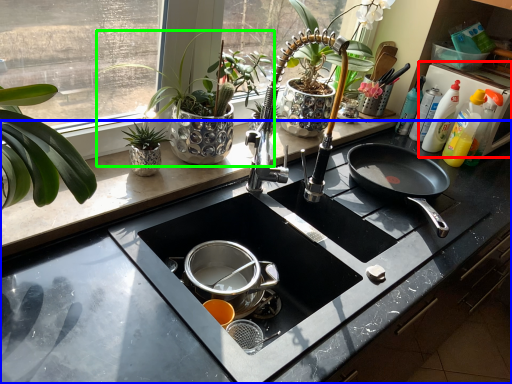
Question: Which object is the closest to the appliance (highlighted by a red box)? Choose among these: countertop (highlighted by a blue box) or houseplant (highlighted by a green box).

Choices:
 (A) countertop
 (B) houseplant

Answer: (A)